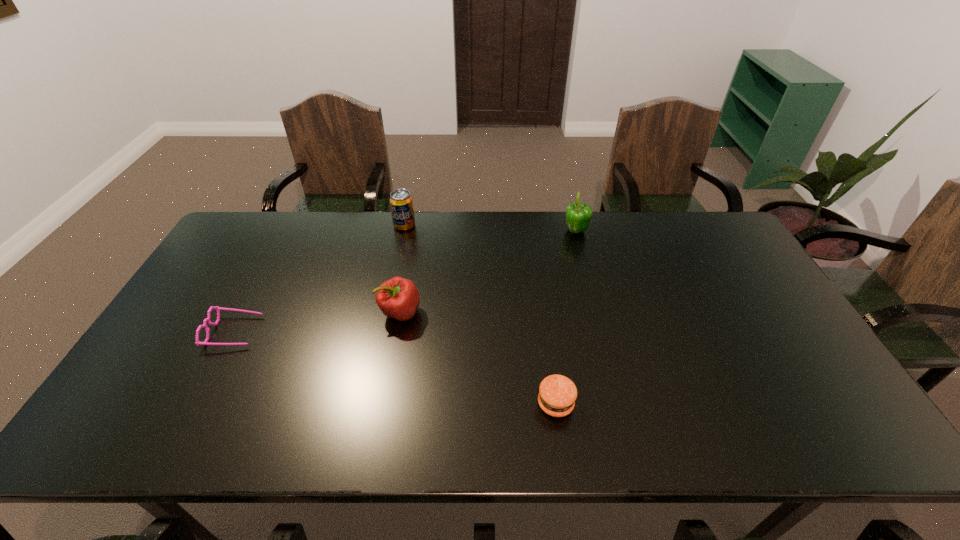
Locate an element on the screen. vacant space at the left edge of the desktop is located at coordinates (219, 325).

Where is `vacant area at the right edge`? vacant area at the right edge is located at coordinates (749, 267).

At what (x,y) coordinates should I click in order to perform the action: click on vacant area at the far left corner of the desktop. Please return your answer as a coordinate pair (x, y). Image resolution: width=960 pixels, height=540 pixels. Looking at the image, I should click on (272, 246).

The width and height of the screenshot is (960, 540). I want to click on vacant space at the near left corner of the desktop, so click(140, 417).

Where is `vacant space that's between the nearest object and the shorter bell pepper`? The width and height of the screenshot is (960, 540). vacant space that's between the nearest object and the shorter bell pepper is located at coordinates (478, 358).

Locate an element on the screen. vacant space that is in between the left bell pepper and the second object from right to left is located at coordinates (478, 358).

I want to click on unoccupied area between the left bell pepper and the rightmost object, so click(488, 272).

This screenshot has width=960, height=540. What are the coordinates of `free spot between the soda can and the spectacles` in the screenshot? It's located at (320, 279).

Where is `free space between the rightmost object and the shorter bell pepper`? The width and height of the screenshot is (960, 540). free space between the rightmost object and the shorter bell pepper is located at coordinates (488, 272).

You are a GUI agent. You are given a task and a screenshot of the screen. Output one action in this format:
    pyautogui.click(x=<x>, y=<y>)
    Task: Click on the empty location between the left bell pepper and the shortest object
    The image size is (960, 540).
    Given the screenshot: What is the action you would take?
    317,322